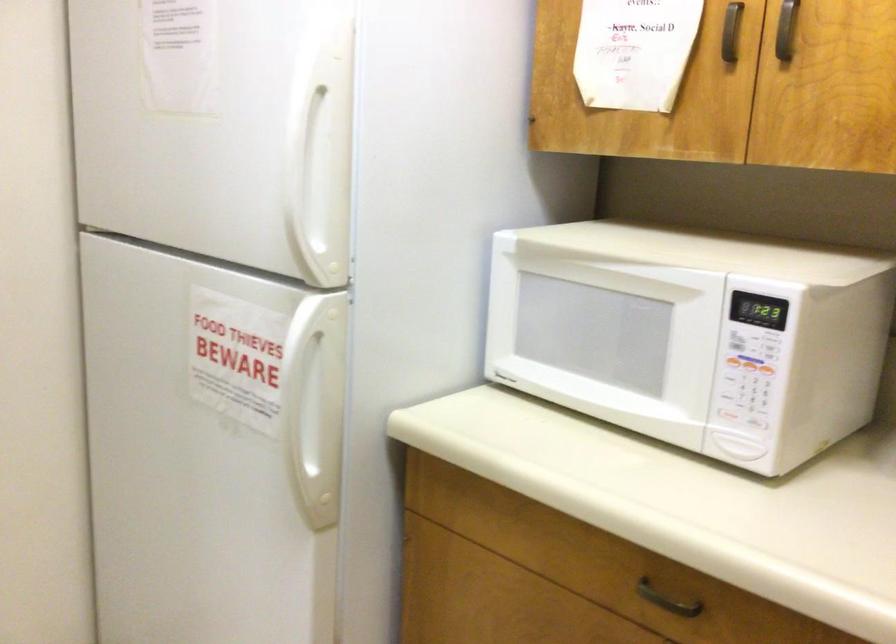
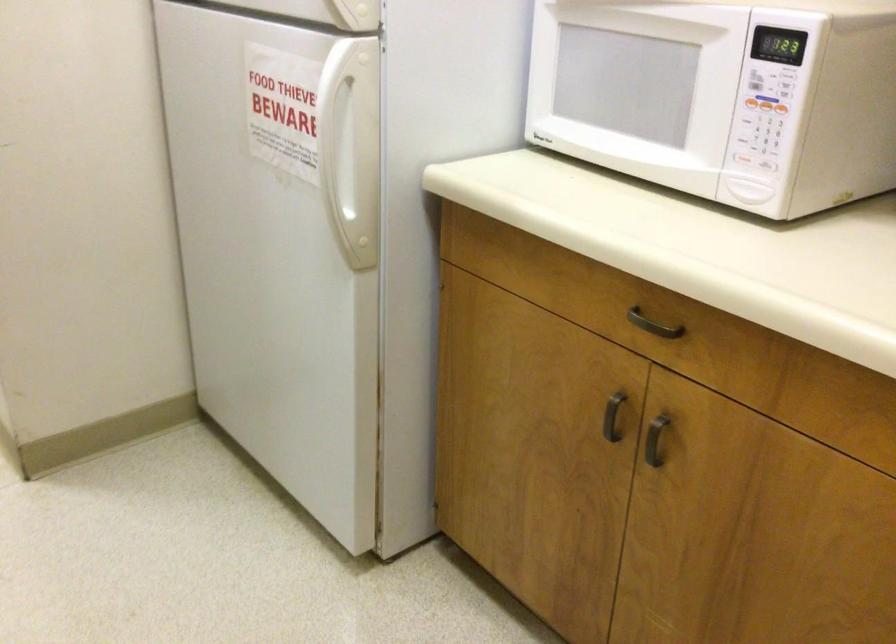
Find the pixel in the second image that matches the point at 769,371 in the first image.

(780, 108)